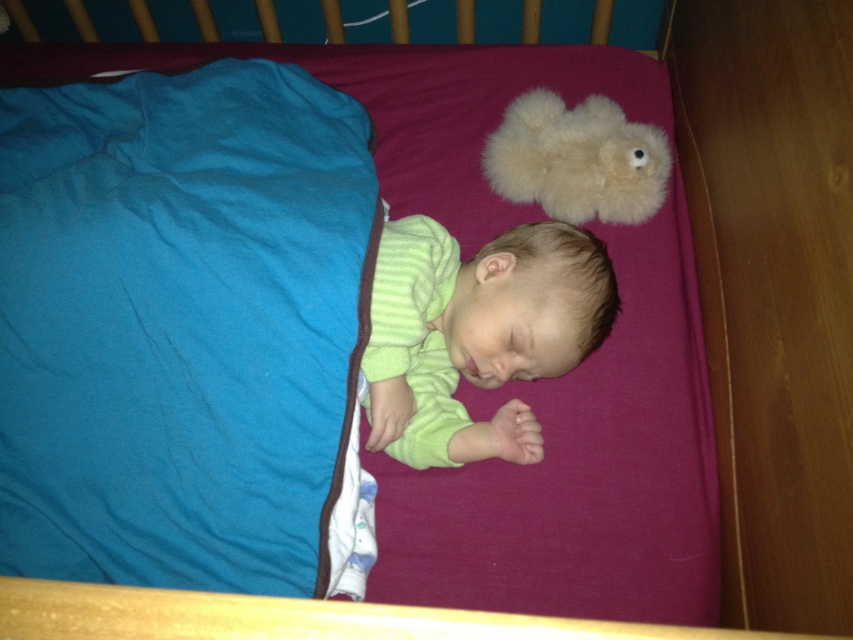
Question: Which of these objects is positioned closest to the fluffy beige teddy bear at upper center?

Choices:
 (A) teal soft fabric at lower left
 (B) green soft baby at center

Answer: (B)

Question: Which of these objects is positioned closest to the teal soft fabric at lower left?

Choices:
 (A) green soft baby at center
 (B) fluffy beige teddy bear at upper center

Answer: (A)

Question: Which is nearer to the fluffy beige teddy bear at upper center?

Choices:
 (A) green soft baby at center
 (B) teal soft fabric at lower left

Answer: (A)

Question: Does teal soft fabric at lower left lie behind fluffy beige teddy bear at upper center?

Choices:
 (A) yes
 (B) no

Answer: (B)

Question: Does teal soft fabric at lower left appear over fluffy beige teddy bear at upper center?

Choices:
 (A) no
 (B) yes

Answer: (A)

Question: Can you confirm if teal soft fabric at lower left is positioned above green soft baby at center?

Choices:
 (A) no
 (B) yes

Answer: (B)